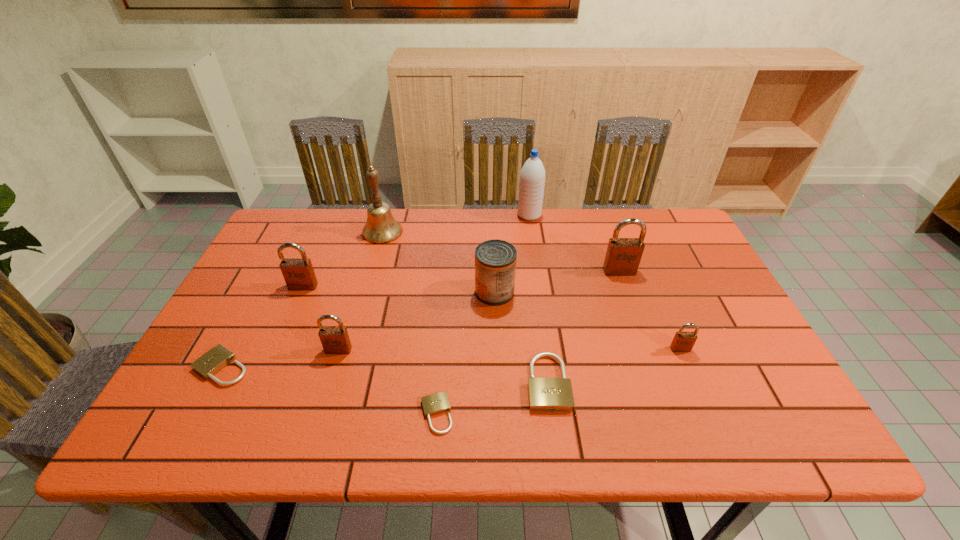
I want to click on the smallest brown padlock, so click(x=683, y=341).

Image resolution: width=960 pixels, height=540 pixels. In order to click on the fourth shortest padlock in this screenshot , I will do `click(683, 341)`.

This screenshot has height=540, width=960. I want to click on the biggest beige padlock, so click(x=545, y=394).

In order to click on the third shortest object in this screenshot , I will do `click(545, 394)`.

Where is `the leftmost padlock`? The height and width of the screenshot is (540, 960). the leftmost padlock is located at coordinates (214, 360).

This screenshot has height=540, width=960. Find the location of `the second shortest object`. the second shortest object is located at coordinates (214, 360).

At what (x,y) coordinates should I click in order to perform the action: click on the fourth padlock from left to right. Please return your answer as a coordinate pair (x, y). This screenshot has height=540, width=960. Looking at the image, I should click on [437, 403].

In order to click on the smallest beige padlock in this screenshot , I will do `click(437, 403)`.

You are a GUI agent. You are given a task and a screenshot of the screen. Output one action in this format:
    pyautogui.click(x=<x>, y=<y>)
    Task: Click on the free spot located 0.360m on the left of the blue water bottle
    This screenshot has width=960, height=540.
    Given the screenshot: What is the action you would take?
    pyautogui.click(x=409, y=215)

Identify the location of vacant space located on the right of the bell. The width and height of the screenshot is (960, 540). click(522, 232).